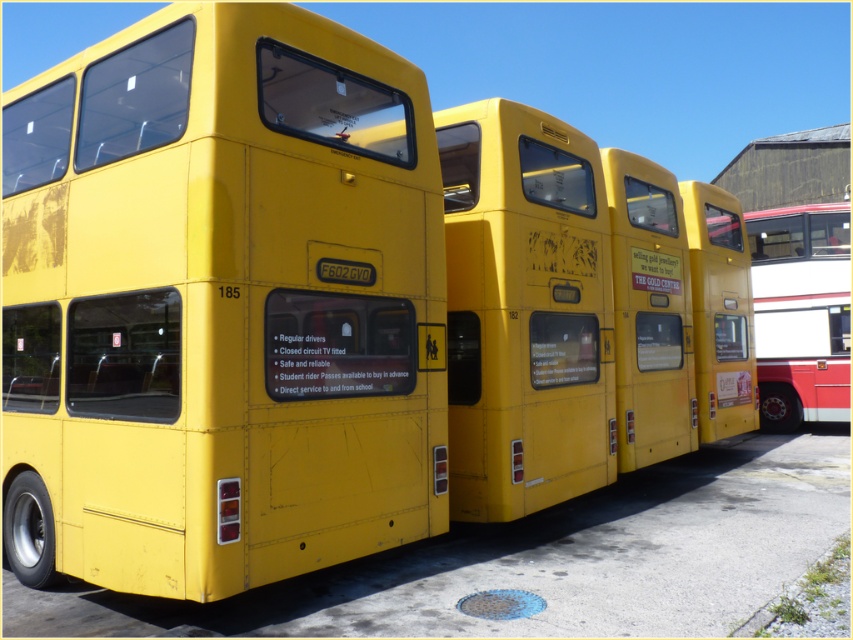
Question: Does yellow matte bus at center have a lesser width compared to yellow matte bus at right?

Choices:
 (A) yes
 (B) no

Answer: (A)

Question: Which is nearer to the yellow matte bus at right?

Choices:
 (A) yellow matte bus at center
 (B) matte yellow bus at left

Answer: (A)

Question: Does yellow matte bus at center have a greater width compared to yellow matte bus at right?

Choices:
 (A) yes
 (B) no

Answer: (B)

Question: Estimate the real-world distances between objects in this image. Which object is farther from the yellow matte bus at center?

Choices:
 (A) matte yellow bus at left
 (B) yellow matte bus at right

Answer: (B)

Question: Among these objects, which one is nearest to the camera?

Choices:
 (A) yellow matte bus at right
 (B) yellow matte bus at center
 (C) matte yellow bus at left

Answer: (C)

Question: Is matte yellow bus at left bigger than yellow matte bus at right?

Choices:
 (A) yes
 (B) no

Answer: (A)